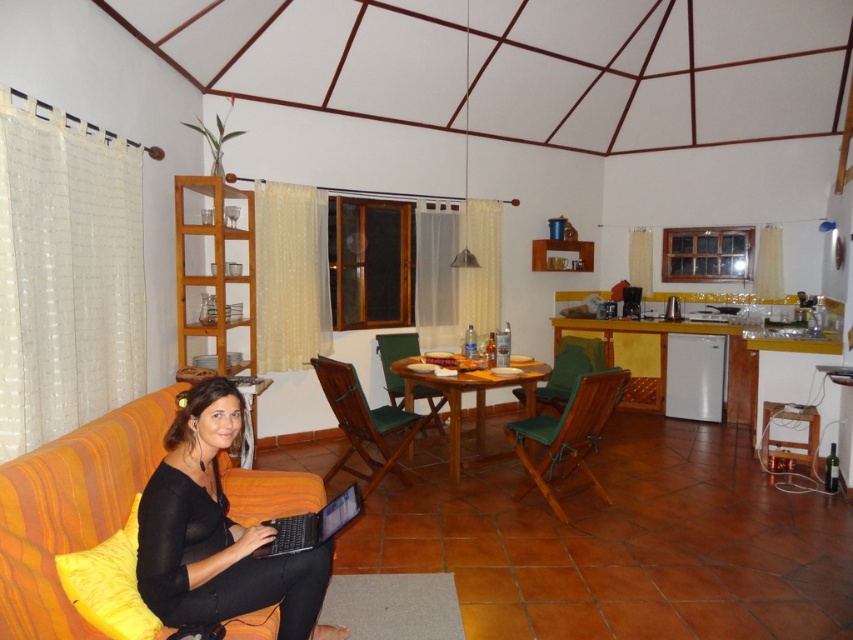
Question: Among these points, which one is nearest to the camera?

Choices:
 (A) (294, 518)
 (B) (218, 531)

Answer: (B)

Question: Is the position of black matte laptop at lower left less distant than that of black plastic laptop at lower left?

Choices:
 (A) no
 (B) yes

Answer: (B)

Question: Which point is farther to the camera?

Choices:
 (A) (279, 538)
 (B) (263, 577)

Answer: (A)

Question: Is black matte laptop at lower left to the right of wooden dining table at center from the viewer's perspective?

Choices:
 (A) no
 (B) yes

Answer: (A)

Question: Which of the following is the closest to the observer?

Choices:
 (A) (408, 380)
 (B) (287, 540)

Answer: (B)

Question: Is wooden dining table at center bigger than black plastic laptop at lower left?

Choices:
 (A) yes
 (B) no

Answer: (A)